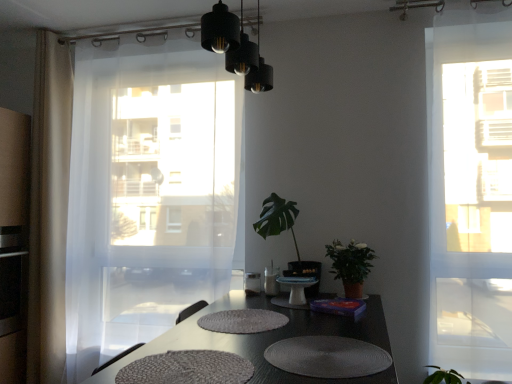
You are a GUI agent. You are given a task and a screenshot of the screen. Output one action in this format:
    pyautogui.click(x=<x>, y=<y>)
    Task: Click on the vacant space underneath gray woven placemat at lower center, arranged as the 1th wide when viewed from the left (from a real-world perspective)
    The image size is (512, 384).
    Given the screenshot: What is the action you would take?
    pyautogui.click(x=190, y=368)